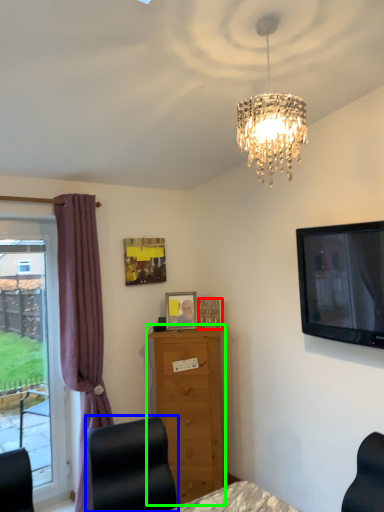
Question: Which is farther away from picture frame (highlighted by a red box)? furniture (highlighted by a blue box) or chest of drawers (highlighted by a green box)?

Choices:
 (A) furniture
 (B) chest of drawers

Answer: (A)